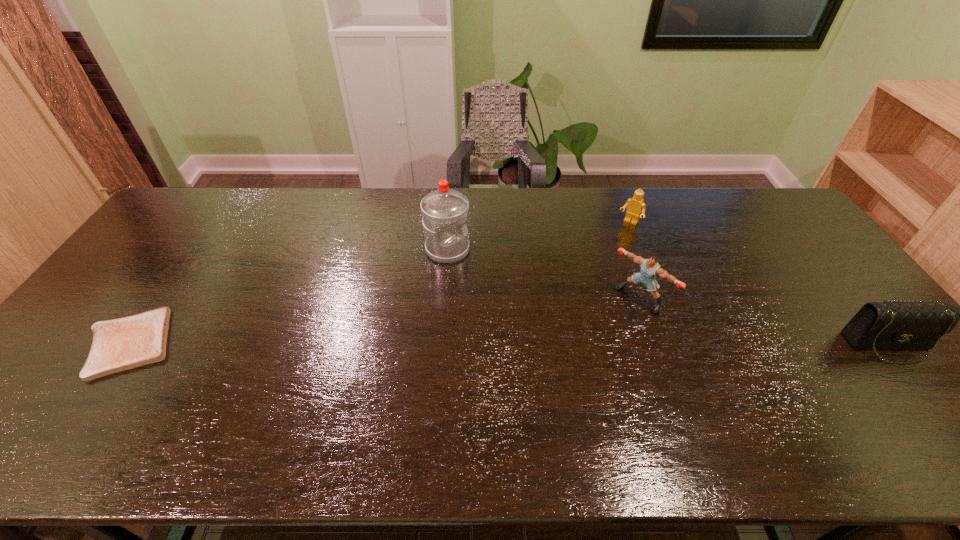
The image size is (960, 540). Identify the location of object that is at the left edge. click(x=120, y=344).

At what (x,y) coordinates should I click in order to perform the action: click on object that is at the right edge. Please return your answer as a coordinate pair (x, y). The image size is (960, 540). Looking at the image, I should click on (897, 324).

Locate an element on the screen. This screenshot has height=540, width=960. object positioned at the near left corner is located at coordinates (120, 344).

The width and height of the screenshot is (960, 540). What are the coordinates of `vacant space at the far edge of the desktop` in the screenshot? It's located at [405, 223].

Locate an element on the screen. The height and width of the screenshot is (540, 960). vacant region at the near edge is located at coordinates (501, 388).

In the image, there is a desktop. At what (x,y) coordinates should I click in order to perform the action: click on free space at the left edge. Please return your answer as a coordinate pair (x, y). Image resolution: width=960 pixels, height=540 pixels. Looking at the image, I should click on (76, 358).

Where is `vacant space at the right edge of the desktop`? The image size is (960, 540). vacant space at the right edge of the desktop is located at coordinates (850, 311).

Image resolution: width=960 pixels, height=540 pixels. What are the coordinates of `vacant region at the far left corner of the desktop` in the screenshot? It's located at (203, 201).

This screenshot has width=960, height=540. Find the location of `vacant area at the near left corner of the desktop`. vacant area at the near left corner of the desktop is located at coordinates (89, 384).

In the image, there is a desktop. Find the location of `vacant space at the near right corner`. vacant space at the near right corner is located at coordinates (x=891, y=409).